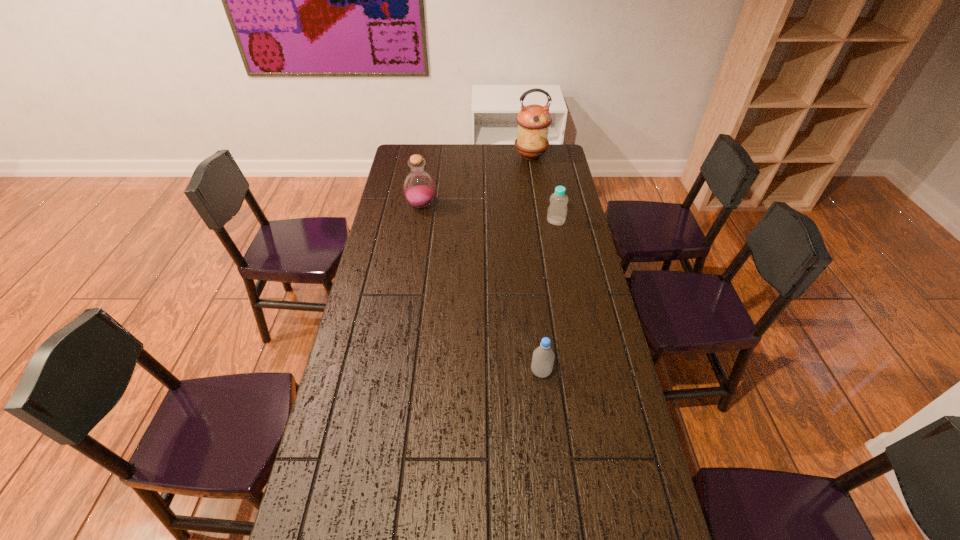
Locate which object is the second closest to the farthest object. Please provide its 2D coordinates. Your answer should be formatted as a tuple, i.e. [(x, y)], where the tuple contains the x and y coordinates of a point satisfying the conditions above.

[(419, 189)]

Identify which bottle is located as the nearest to the second bottle from left to right. Please provide its 2D coordinates. Your answer should be formatted as a tuple, i.e. [(x, y)], where the tuple contains the x and y coordinates of a point satisfying the conditions above.

[(557, 211)]

Locate an element on the screen. the closest bottle to the tallest object is located at coordinates (557, 211).

At what (x,y) coordinates should I click in order to perform the action: click on free location that satisfies the following two spatial constraints: 1. on the back side of the oil lamp; 2. on the left side of the nearest object. Please return your answer as a coordinate pair (x, y). This screenshot has height=540, width=960. Looking at the image, I should click on (516, 156).